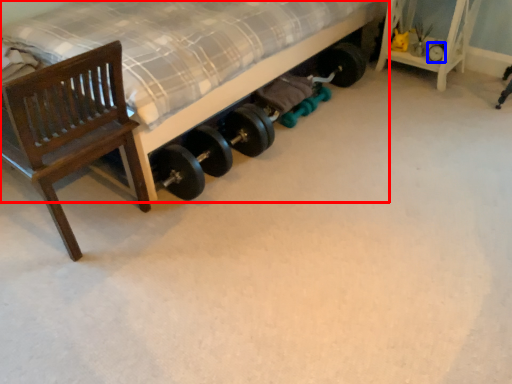
Question: Which object is closer to the camera taking this photo, bed (highlighted by a red box) or tire (highlighted by a blue box)?

Choices:
 (A) bed
 (B) tire

Answer: (A)